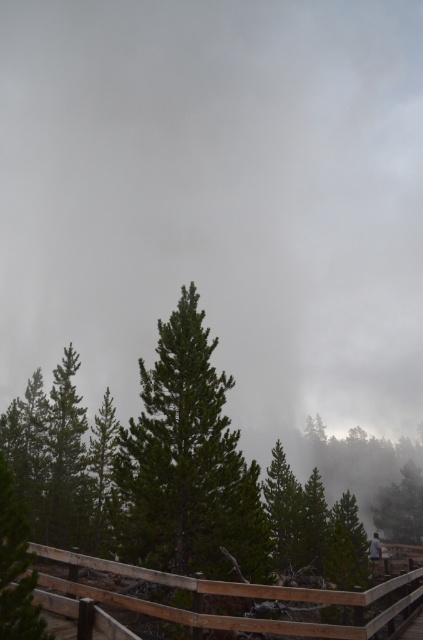
You are standing on a wooden walkway surrounded by a dense forest. You notice two trees in front of you, the green matte tree at center and the green matte tree at lower left. Which tree appears taller?

The green matte tree at center is taller than the green matte tree at lower left.

You are standing on a wooden walkway surrounded by a dense forest of green matte trees. You notice a green matte tree at center and a green matte tree at lower left. Which tree is positioned lower in the image?

The green matte tree at center is positioned lower than the green matte tree at lower left.

You are standing on a wooden walkway surrounded by a dense forest. You notice a green matte tree at center and a light gray fabric jacket at center. Which object is bigger?

The green matte tree at center is larger than the light gray fabric jacket at center.